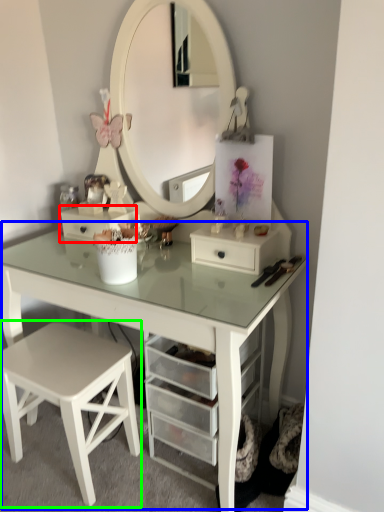
Question: Which is farther away from drawer (highlighted by a red box)? table (highlighted by a blue box) or stool (highlighted by a green box)?

Choices:
 (A) table
 (B) stool

Answer: (B)